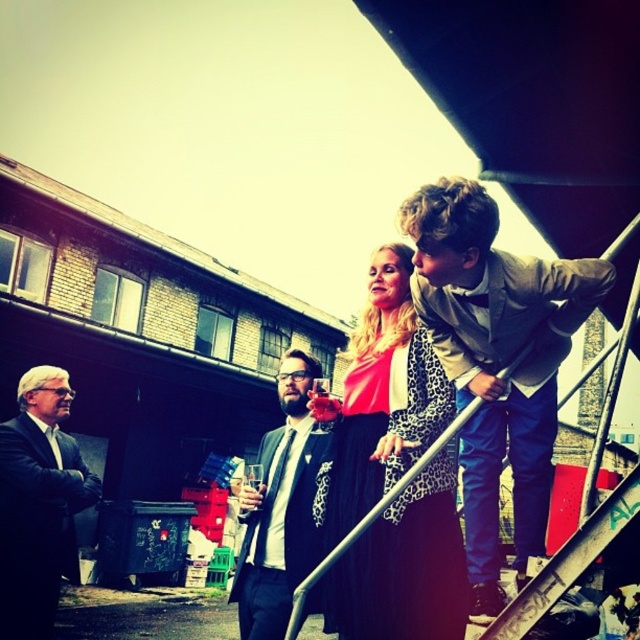
Who is positioned more to the left, leopard print dress at center or black suit at left?

black suit at left

Does point (326, 403) come behind point (16, 563)?

No, (326, 403) is closer to viewer.

Identify the location of leopard print dress at center. (380, 401).

Is point (412, 618) positioned before point (260, 577)?

Yes, it is in front of point (260, 577).

Looking at this image, between leopard print dress at center and matte black suit at center, which one has more height?

Standing taller between the two is leopard print dress at center.

The height and width of the screenshot is (640, 640). Describe the element at coordinates (380, 401) in the screenshot. I see `leopard print dress at center` at that location.

The height and width of the screenshot is (640, 640). Find the location of `leopard print dress at center`. leopard print dress at center is located at coordinates (380, 401).

Is black suit at left positioned in front of matte black suit at center?

No, it is behind matte black suit at center.

Who is more distant from viewer, (20, 550) or (268, 604)?

The point (20, 550) is behind.

Locate an element on the screen. black suit at left is located at coordinates (36, 500).